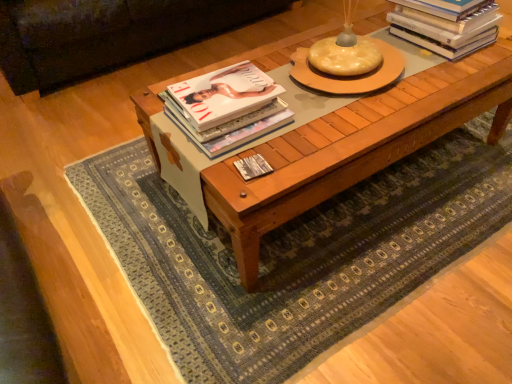
Locate an element on the screen. space that is in front of white glossy book at center, the third book viewed from the top is located at coordinates (249, 193).